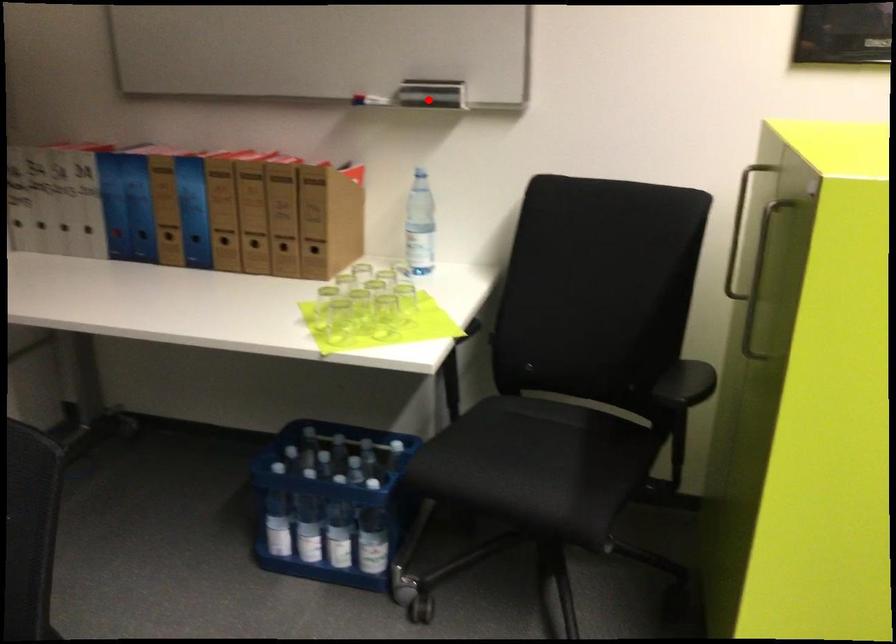
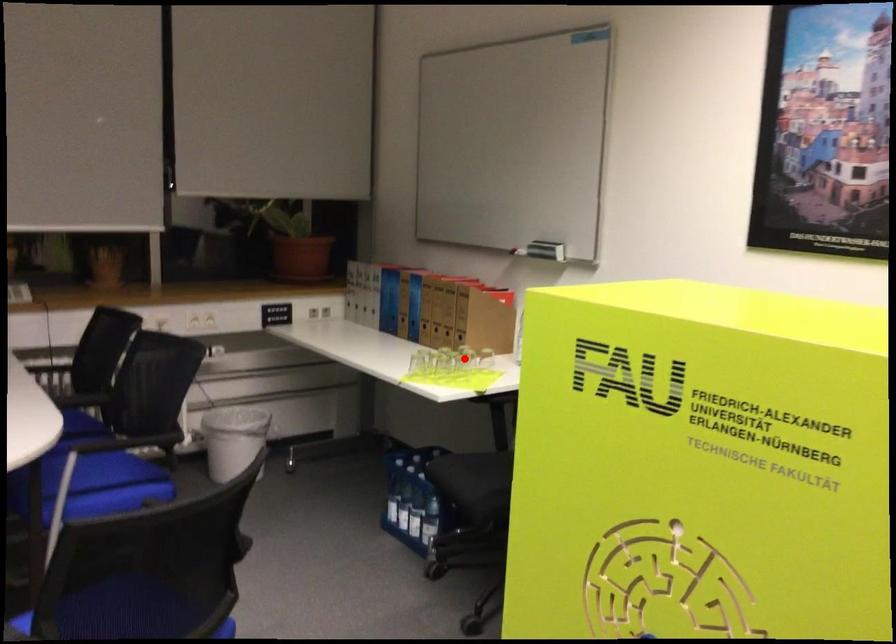
I am providing you with two images of the same scene from different viewpoints. A red point is marked on the first image and another point is marked on the second image. Is the marked point in image1 the same physical position as the marked point in image2?

No